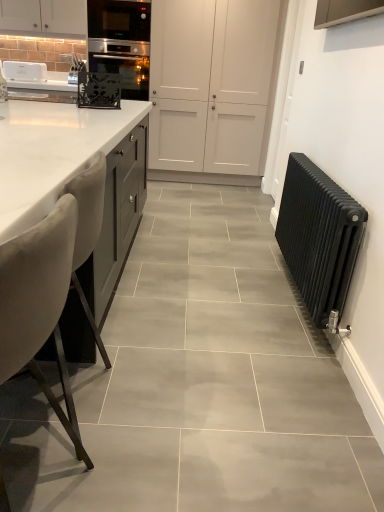
Question: Is white matte cabinet at upper center positioned behind white marble countertop at left?

Choices:
 (A) no
 (B) yes

Answer: (B)

Question: Is white matte cabinet at upper center wider than white marble countertop at left?

Choices:
 (A) no
 (B) yes

Answer: (A)

Question: Can you confirm if white matte cabinet at upper center is taller than white marble countertop at left?

Choices:
 (A) yes
 (B) no

Answer: (A)

Question: From the image's perspective, is white matte cabinet at upper center above white marble countertop at left?

Choices:
 (A) no
 (B) yes

Answer: (B)

Question: Does white matte cabinet at upper center appear on the left side of white marble countertop at left?

Choices:
 (A) no
 (B) yes

Answer: (A)

Question: From the image's perspective, relative to velvet beige chair at left, is white matte cabinet at upper center above or below?

Choices:
 (A) above
 (B) below

Answer: (A)

Question: Is white matte cabinet at upper center spatially inside velvet beige chair at left, or outside of it?

Choices:
 (A) outside
 (B) inside

Answer: (A)

Question: From a real-world perspective, relative to velvet beige chair at left, is white matte cabinet at upper center vertically above or below?

Choices:
 (A) above
 (B) below

Answer: (A)

Question: Is point (195, 119) closer or farther from the camera than point (23, 296)?

Choices:
 (A) farther
 (B) closer

Answer: (A)

Question: Is velvet beige chair at left taller or shorter than black cast iron radiator at right?

Choices:
 (A) short
 (B) tall

Answer: (B)

Question: Do you think velvet beige chair at left is within black cast iron radiator at right, or outside of it?

Choices:
 (A) outside
 (B) inside

Answer: (A)

Question: From a real-world perspective, is velvet beige chair at left positioned above or below black cast iron radiator at right?

Choices:
 (A) below
 (B) above

Answer: (B)

Question: Considering the positions of velvet beige chair at left and black cast iron radiator at right in the image, is velvet beige chair at left wider or thinner than black cast iron radiator at right?

Choices:
 (A) wide
 (B) thin

Answer: (A)

Question: In terms of height, does black cast iron radiator at right look taller or shorter compared to velvet beige chair at left?

Choices:
 (A) short
 (B) tall

Answer: (A)

Question: Based on their positions, is black cast iron radiator at right located to the left or right of velvet beige chair at left?

Choices:
 (A) left
 (B) right

Answer: (B)